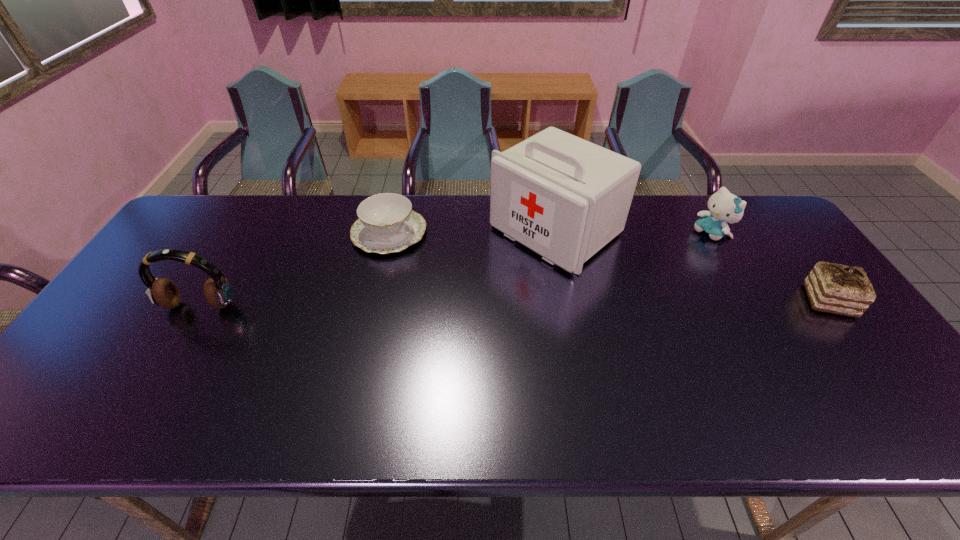
The width and height of the screenshot is (960, 540). I want to click on kitten that is at the far edge, so click(724, 207).

Find the location of `chinaware present at the far edge`. chinaware present at the far edge is located at coordinates (387, 223).

You are a GUI agent. You are given a task and a screenshot of the screen. Output one action in this format:
    pyautogui.click(x=<x>, y=<y>)
    Task: Click on the object present at the left edge
    The image size is (960, 540).
    Given the screenshot: What is the action you would take?
    pyautogui.click(x=218, y=292)

Locate an element on the screen. This screenshot has height=540, width=960. object at the right edge is located at coordinates (834, 288).

In the image, there is a desktop. Where is `vacant area at the far edge`? Image resolution: width=960 pixels, height=540 pixels. vacant area at the far edge is located at coordinates (449, 224).

Identify the location of vacant space at the near edge of the desktop. (188, 391).

This screenshot has width=960, height=540. In order to click on blank space at the left edge in this screenshot , I will do [x=178, y=276].

Locate an element on the screen. This screenshot has width=960, height=540. vacant space at the right edge is located at coordinates (859, 345).

Image resolution: width=960 pixels, height=540 pixels. In order to click on vacant area at the far left corner of the desktop in this screenshot , I will do [x=182, y=220].

In the image, there is a desktop. At what (x,y) coordinates should I click in order to perform the action: click on vacant area at the far right corner. Please return your answer as a coordinate pair (x, y). The height and width of the screenshot is (540, 960). Looking at the image, I should click on (790, 237).